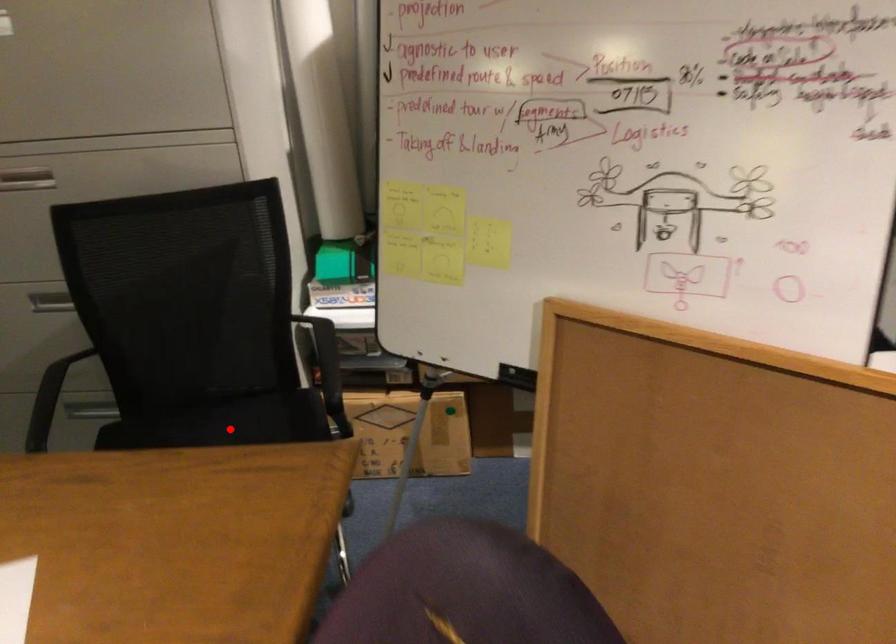
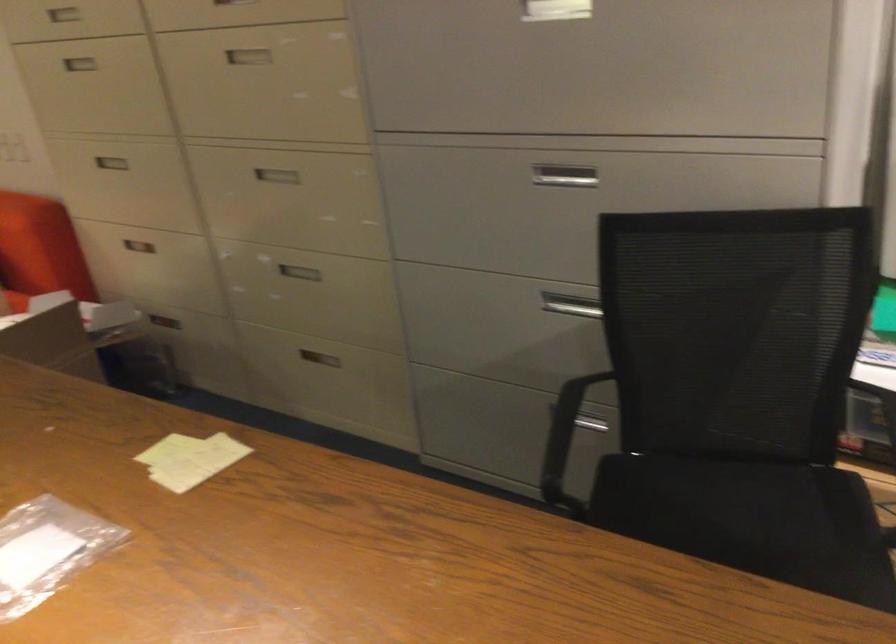
Locate, in the second image, the point that corresponds to the highlighted location in the first image.

(739, 496)